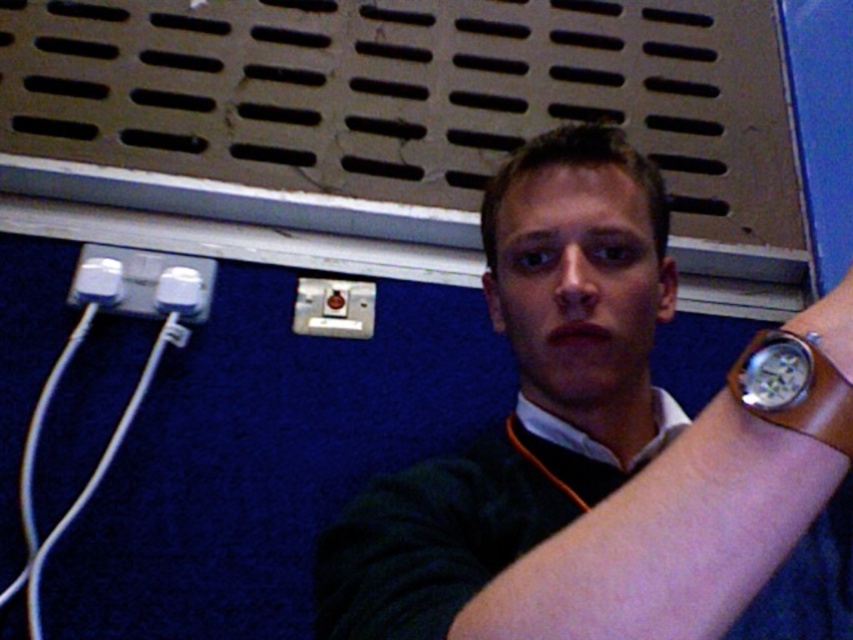
Which is behind, point (791, 364) or point (335, 332)?

Point (335, 332)

Is brown leather watch at upper right taller than metallic silver plug at center?

Yes, brown leather watch at upper right is taller than metallic silver plug at center.

This screenshot has width=853, height=640. What are the coordinates of `brown leather watch at upper right` in the screenshot? It's located at (611, 449).

At what (x,y) coordinates should I click in order to perform the action: click on brown leather watch at upper right. Please return your answer as a coordinate pair (x, y). Looking at the image, I should click on (611, 449).

Consider the image. Who is taller, brown leather watch at upper right or white plastic plug at left?

Standing taller between the two is brown leather watch at upper right.

Is brown leather watch at upper right taller than white plastic plug at left?

Correct, brown leather watch at upper right is much taller as white plastic plug at left.

Between point (631, 349) and point (194, 314), which one is positioned in front?

Positioned in front is point (631, 349).

The height and width of the screenshot is (640, 853). What are the coordinates of `brown leather watch at upper right` in the screenshot? It's located at (611, 449).

Who is more distant from viewer, (601,540) or (836,451)?

The point (601,540) is behind.

Who is positioned more to the left, brown leather watch at upper right or silver metallic watch at upper right?

Positioned to the left is brown leather watch at upper right.

Which is in front, point (633, 308) or point (813, 346)?

Positioned in front is point (813, 346).

Find the location of a particular element. The image size is (853, 640). brown leather watch at upper right is located at coordinates (611, 449).